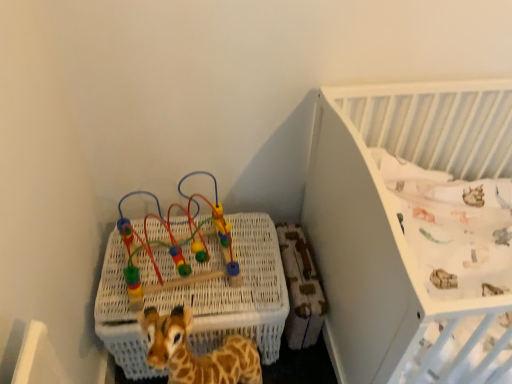
Question: Is white textured crib at upper right thinner than white wicker basket at lower left?

Choices:
 (A) no
 (B) yes

Answer: (A)

Question: Does white textured crib at upper right come in front of white wicker basket at lower left?

Choices:
 (A) yes
 (B) no

Answer: (A)

Question: Is white textured crib at upper right far from white wicker basket at lower left?

Choices:
 (A) yes
 (B) no

Answer: (B)

Question: Considering the relative sizes of white textured crib at upper right and white wicker basket at lower left in the image provided, is white textured crib at upper right smaller than white wicker basket at lower left?

Choices:
 (A) yes
 (B) no

Answer: (B)

Question: Considering the relative sizes of white textured crib at upper right and white wicker basket at lower left in the image provided, is white textured crib at upper right bigger than white wicker basket at lower left?

Choices:
 (A) yes
 (B) no

Answer: (A)

Question: Visually, is white wicker basket at lower left positioned to the left or to the right of multicolored plastic bead maze at upper left?

Choices:
 (A) right
 (B) left

Answer: (A)

Question: From their relative heights in the image, would you say white wicker basket at lower left is taller or shorter than multicolored plastic bead maze at upper left?

Choices:
 (A) tall
 (B) short

Answer: (A)

Question: Do you think white wicker basket at lower left is within multicolored plastic bead maze at upper left, or outside of it?

Choices:
 (A) outside
 (B) inside

Answer: (A)

Question: Is white wicker basket at lower left wider or thinner than multicolored plastic bead maze at upper left?

Choices:
 (A) wide
 (B) thin

Answer: (A)

Question: Considering the positions of multicolored plastic bead maze at upper left and white textured crib at upper right in the image, is multicolored plastic bead maze at upper left wider or thinner than white textured crib at upper right?

Choices:
 (A) wide
 (B) thin

Answer: (B)

Question: From a real-world perspective, relative to white textured crib at upper right, is multicolored plastic bead maze at upper left vertically above or below?

Choices:
 (A) below
 (B) above

Answer: (B)

Question: Which is correct: multicolored plastic bead maze at upper left is inside white textured crib at upper right, or outside of it?

Choices:
 (A) outside
 (B) inside

Answer: (A)

Question: Is multicolored plastic bead maze at upper left in front of or behind white textured crib at upper right in the image?

Choices:
 (A) front
 (B) behind

Answer: (B)

Question: In terms of height, does multicolored plastic bead maze at upper left look taller or shorter compared to white wicker basket at lower left?

Choices:
 (A) short
 (B) tall

Answer: (A)

Question: From the image's perspective, is multicolored plastic bead maze at upper left above or below white wicker basket at lower left?

Choices:
 (A) below
 (B) above

Answer: (B)